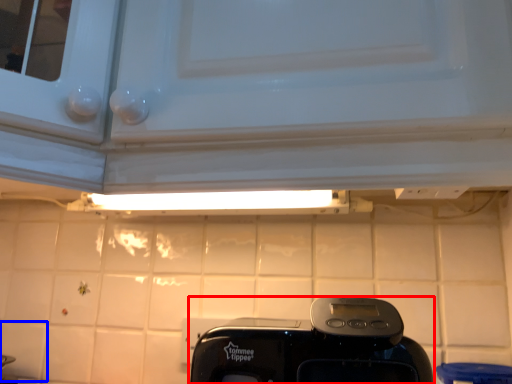
Question: Which point is closer to the camera, home appliance (highlighted by a red box) or tile (highlighted by a blue box)?

Choices:
 (A) home appliance
 (B) tile

Answer: (A)